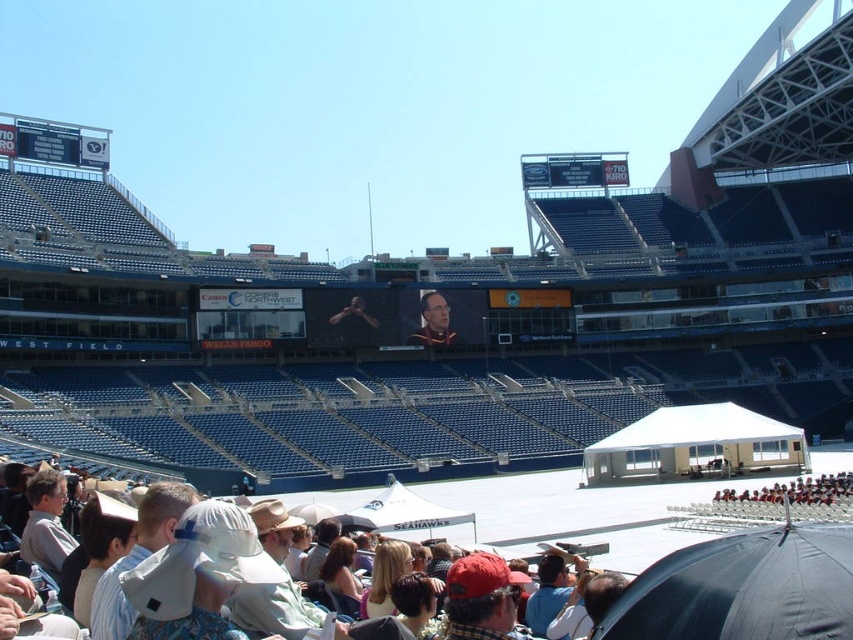
Based on the photo, you are looking at the stadium from the entrance. Which scoreboard, the white digital scoreboard at upper left or the blue plastic scoreboard at upper center, is positioned higher up in your field of view?

The blue plastic scoreboard at upper center is positioned higher up in your field of view because the white digital scoreboard at upper left is located below it.

You are planning to set up a temporary stage for a speaker in the stadium. The stage needs to be placed where it can be seen clearly by everyone, including those at the blue plastic scoreboard at upper center and the matte black suit at center. Considering their sizes, which object should the stage be positioned closer to for optimal visibility?

The stage should be positioned closer to the blue plastic scoreboard at upper center because it has a larger size, making it easier to see from a distance compared to the matte black suit at center.